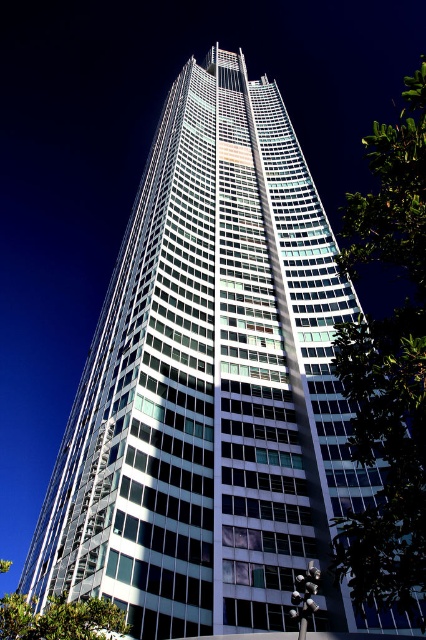
You are standing in front of the skyscraper and want to take a photo that includes both the green leafy tree at right and the green leafy tree at lower left. Which tree will appear larger in the photo?

The green leafy tree at right will appear larger in the photo because it is closer to the viewer than the green leafy tree at lower left.

You are standing in front of the skyscraper and see two green leafy tree at right and green leafy tree at lower left. Which tree is located more to the right side of the skyscraper?

The green leafy tree at right is positioned on the right side of the green leafy tree at lower left, so it is more to the right side of the skyscraper.

You are an urban planner assessing the greenery in the city. You notice two green leafy trees in the scene. Which tree, the green leafy tree at right or the green leafy tree at lower left, has a wider spread?

The green leafy tree at right has a wider spread than the green leafy tree at lower left.